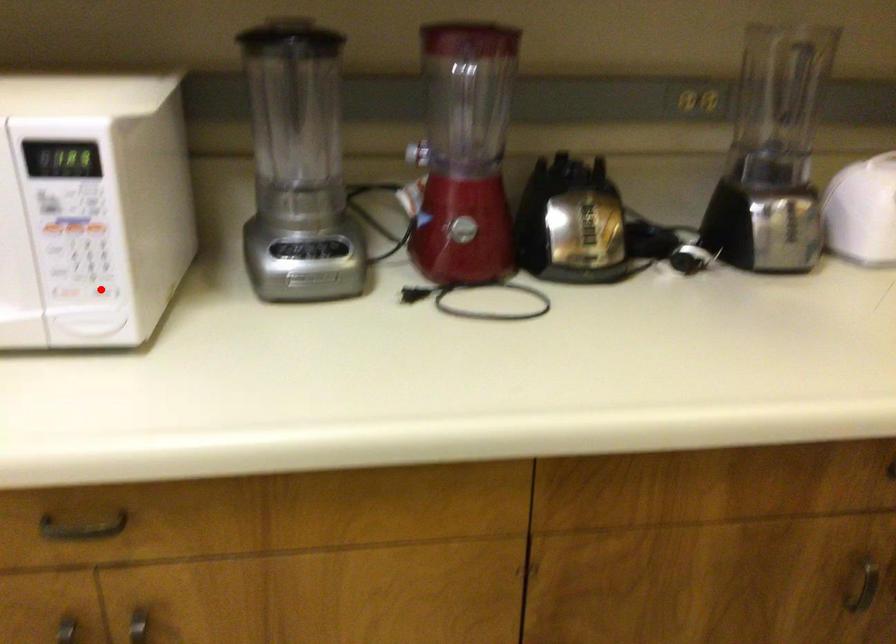
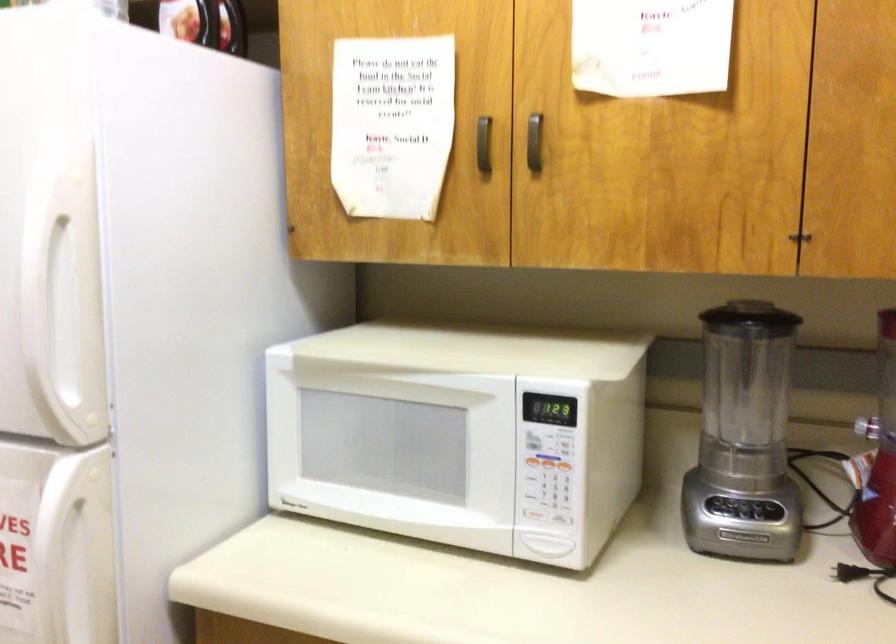
Locate, in the second image, the point that corresponds to the highlighted location in the first image.

(563, 518)